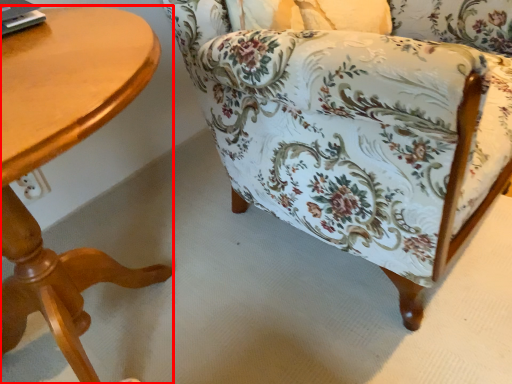
Question: Where is table (annotated by the red box) located in relation to chair in the image?

Choices:
 (A) right
 (B) left

Answer: (B)